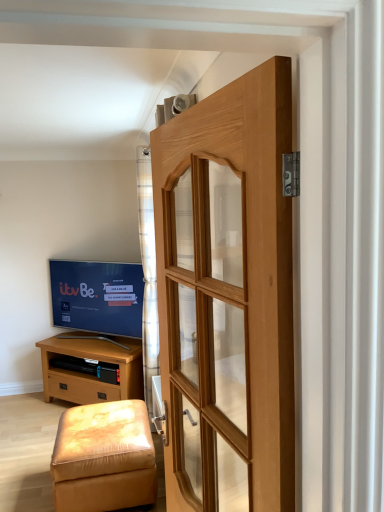
Question: From the image's perspective, is matte black tv at left below natural wood door at center?

Choices:
 (A) yes
 (B) no

Answer: (A)

Question: Is matte black tv at left turned away from natural wood door at center?

Choices:
 (A) yes
 (B) no

Answer: (B)

Question: Is matte black tv at left surrounding natural wood door at center?

Choices:
 (A) yes
 (B) no

Answer: (B)

Question: From a real-world perspective, is matte black tv at left positioned under natural wood door at center based on gravity?

Choices:
 (A) no
 (B) yes

Answer: (B)

Question: Does matte black tv at left have a larger size compared to natural wood door at center?

Choices:
 (A) yes
 (B) no

Answer: (A)

Question: Does matte black tv at left appear on the right side of natural wood door at center?

Choices:
 (A) no
 (B) yes

Answer: (A)

Question: Is natural wood door at center beside light brown wood chest of drawers at lower left?

Choices:
 (A) no
 (B) yes

Answer: (A)

Question: Can you confirm if natural wood door at center is thinner than light brown wood chest of drawers at lower left?

Choices:
 (A) no
 (B) yes

Answer: (B)

Question: Is natural wood door at center turned away from light brown wood chest of drawers at lower left?

Choices:
 (A) yes
 (B) no

Answer: (B)

Question: From the image's perspective, does natural wood door at center appear higher than light brown wood chest of drawers at lower left?

Choices:
 (A) no
 (B) yes

Answer: (B)

Question: Is natural wood door at center wider than light brown wood chest of drawers at lower left?

Choices:
 (A) yes
 (B) no

Answer: (B)

Question: Does natural wood door at center come behind light brown wood chest of drawers at lower left?

Choices:
 (A) no
 (B) yes

Answer: (A)

Question: Is light brown wood chest of drawers at lower left touching plaid fabric curtain at center?

Choices:
 (A) yes
 (B) no

Answer: (B)